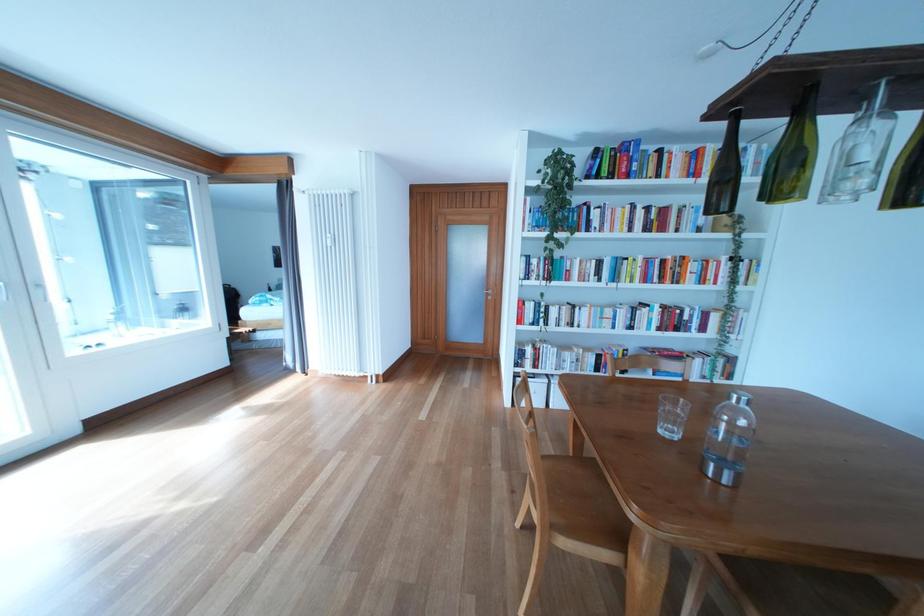
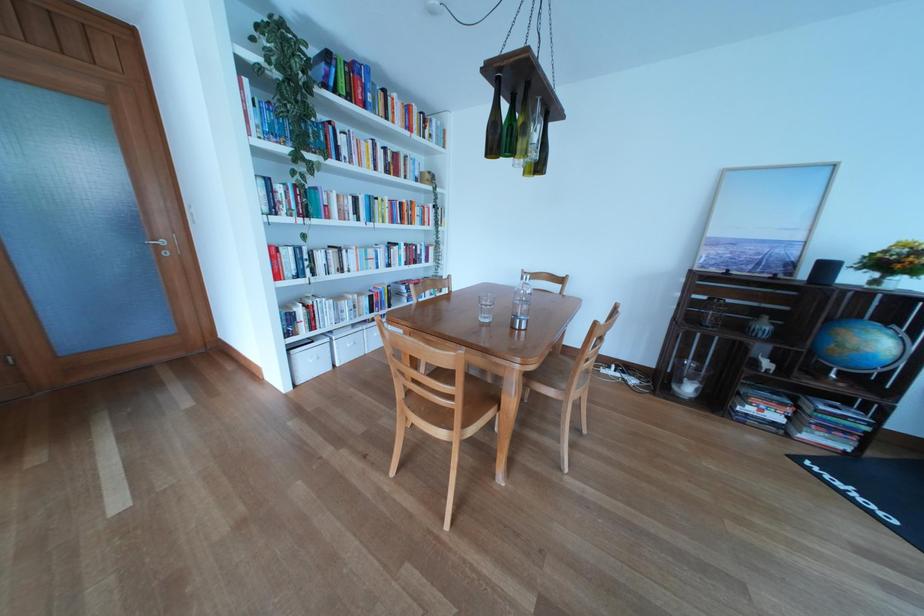
Locate, in the second image, the point that corresponds to (x=504, y=298) in the first image.

(176, 248)